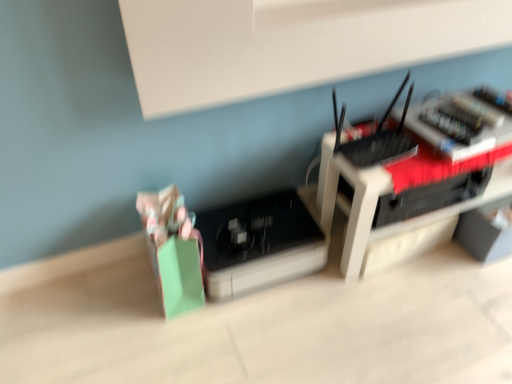
The height and width of the screenshot is (384, 512). What are the coordinates of `free space in front of black plastic register at center, marked as the first register in a bottom-to-top arrangement` in the screenshot? It's located at (268, 336).